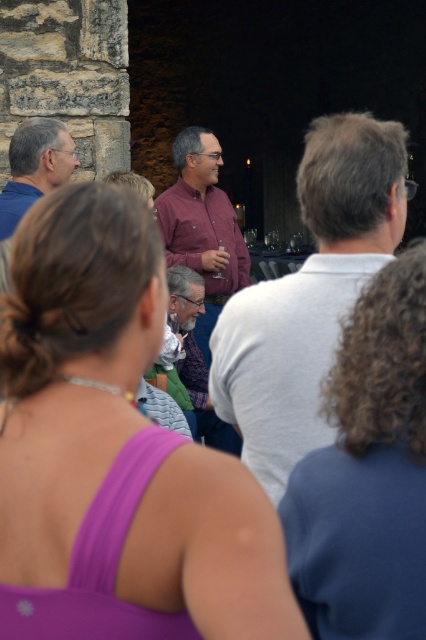
Can you confirm if matte purple shirt at center is positioned above matte gray shirt at left?

Actually, matte purple shirt at center is below matte gray shirt at left.

Which is in front, point (215, 179) or point (19, 163)?

Point (19, 163)

At what (x,y) coordinates should I click in order to perform the action: click on matte purple shirt at center. Please return your answer as a coordinate pair (x, y). Looking at the image, I should click on (203, 227).

Does purple fabric top at center have a lesser width compared to matte pink shirt at center?

Yes.

What are the coordinates of `purple fabric top at center` in the screenshot? It's located at (71, 365).

Describe the element at coordinates (368, 474) in the screenshot. I see `curly hair at center` at that location.

From the picture: Can you confirm if curly hair at center is wider than matte purple shirt at center?

No.

Image resolution: width=426 pixels, height=640 pixels. I want to click on curly hair at center, so click(x=368, y=474).